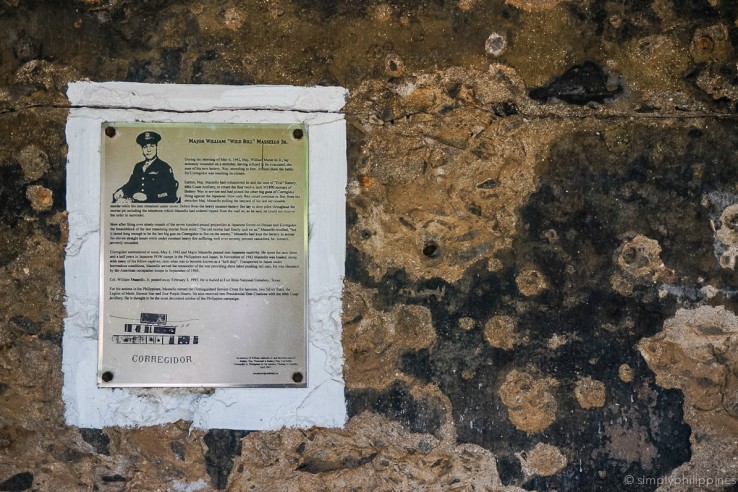
The height and width of the screenshot is (492, 738). I want to click on something to stick the poster to the wall, so click(x=297, y=135), click(x=108, y=132), click(x=102, y=373), click(x=297, y=376).